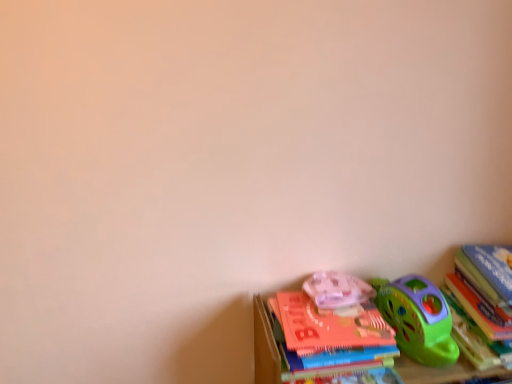
Where is `empty space that is to the right of translucent plastic toy at lower right`? empty space that is to the right of translucent plastic toy at lower right is located at coordinates (399, 309).